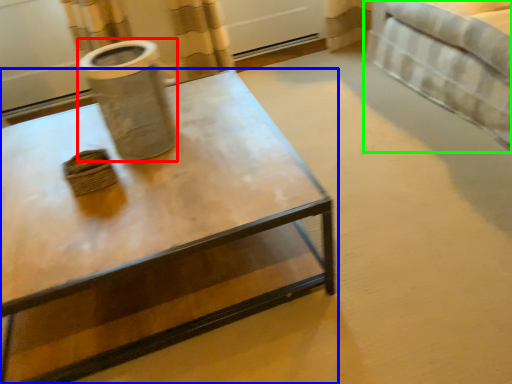
Question: Which object is positioned farthest from vase (highlighted by a red box)? Select from coffee table (highlighted by a blue box) and bed (highlighted by a green box).

Choices:
 (A) coffee table
 (B) bed

Answer: (B)